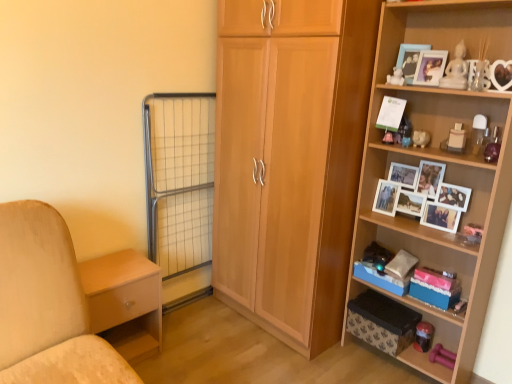
Question: Can you confirm if white matte bear at upper right, placed as the 2th toy when sorted from back to front, is shorter than wooden photo frame at upper right, the 1th picture frame when ordered from left to right?

Choices:
 (A) yes
 (B) no

Answer: (A)

Question: Is white matte bear at upper right, placed as the 2th toy when sorted from back to front, taller than wooden photo frame at upper right, the 1th picture frame when ordered from left to right?

Choices:
 (A) yes
 (B) no

Answer: (B)

Question: Is white matte bear at upper right, positioned as the third toy in right-to-left order, further to camera compared to wooden photo frame at upper right, the 1th picture frame when ordered from left to right?

Choices:
 (A) no
 (B) yes

Answer: (A)

Question: Can you confirm if white matte bear at upper right, positioned as the third toy in right-to-left order, is smaller than wooden photo frame at upper right, the 1th picture frame when ordered from left to right?

Choices:
 (A) yes
 (B) no

Answer: (A)

Question: Considering the relative sizes of white matte bear at upper right, arranged as the 2th toy when viewed from the top, and wooden photo frame at upper right, the 1th picture frame when ordered from left to right, in the image provided, is white matte bear at upper right, arranged as the 2th toy when viewed from the top, wider than wooden photo frame at upper right, the 1th picture frame when ordered from left to right,?

Choices:
 (A) yes
 (B) no

Answer: (A)

Question: Choose the correct answer: Is metal grid screen door at lower left inside pink fabric storage box at lower right, which is the second storage box from bottom to top, or outside it?

Choices:
 (A) inside
 (B) outside

Answer: (B)

Question: Is metal grid screen door at lower left in front of or behind pink fabric storage box at lower right, the 2th storage box when ordered from top to bottom, in the image?

Choices:
 (A) behind
 (B) front

Answer: (A)

Question: From the image's perspective, is metal grid screen door at lower left located above or below pink fabric storage box at lower right, which is the second storage box from bottom to top?

Choices:
 (A) below
 (B) above

Answer: (B)

Question: Considering the positions of metal grid screen door at lower left and pink fabric storage box at lower right, the 2th storage box when ordered from top to bottom, in the image, is metal grid screen door at lower left taller or shorter than pink fabric storage box at lower right, the 2th storage box when ordered from top to bottom,?

Choices:
 (A) tall
 (B) short

Answer: (A)

Question: Is metal grid screen door at lower left in front of or behind white wooden photo frames at upper right, acting as the first shelf starting from the top, in the image?

Choices:
 (A) behind
 (B) front

Answer: (A)

Question: From the image's perspective, is metal grid screen door at lower left located above or below white wooden photo frames at upper right, the 2th shelf in the bottom-to-top sequence?

Choices:
 (A) below
 (B) above

Answer: (A)

Question: In terms of width, does metal grid screen door at lower left look wider or thinner when compared to white wooden photo frames at upper right, acting as the first shelf starting from the top?

Choices:
 (A) thin
 (B) wide

Answer: (A)

Question: Is point (166, 135) closer or farther from the camera than point (379, 221)?

Choices:
 (A) closer
 (B) farther

Answer: (B)

Question: Considering the relative positions of white matte bear at upper right, arranged as the 2th toy when viewed from the top, and white matte piggy bank at upper right, which is the 1th toy in bottom-to-top order, in the image provided, is white matte bear at upper right, arranged as the 2th toy when viewed from the top, to the left or to the right of white matte piggy bank at upper right, which is the 1th toy in bottom-to-top order,?

Choices:
 (A) left
 (B) right

Answer: (A)

Question: Is white matte bear at upper right, acting as the second toy starting from the front, taller or shorter than white matte piggy bank at upper right, arranged as the 3th toy when viewed from the top?

Choices:
 (A) short
 (B) tall

Answer: (A)